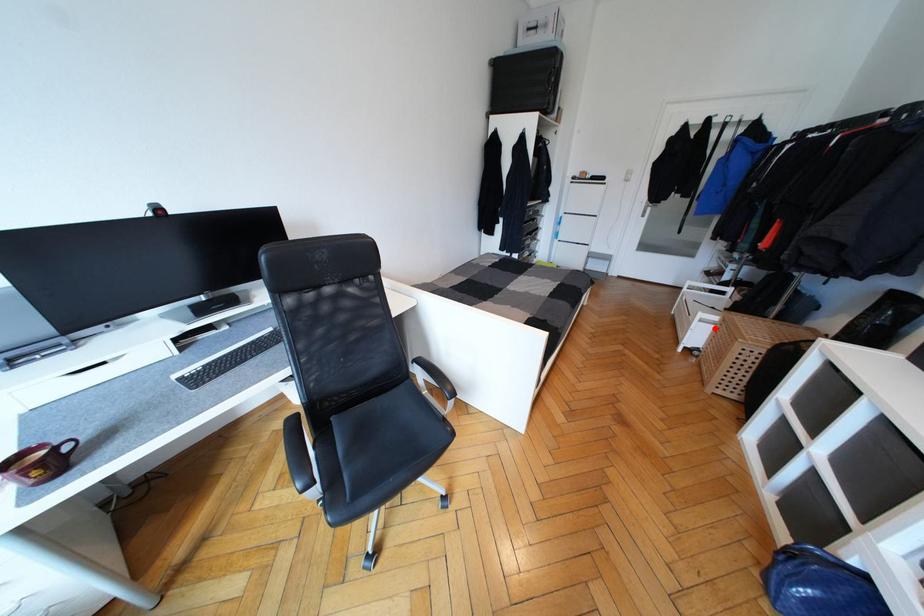
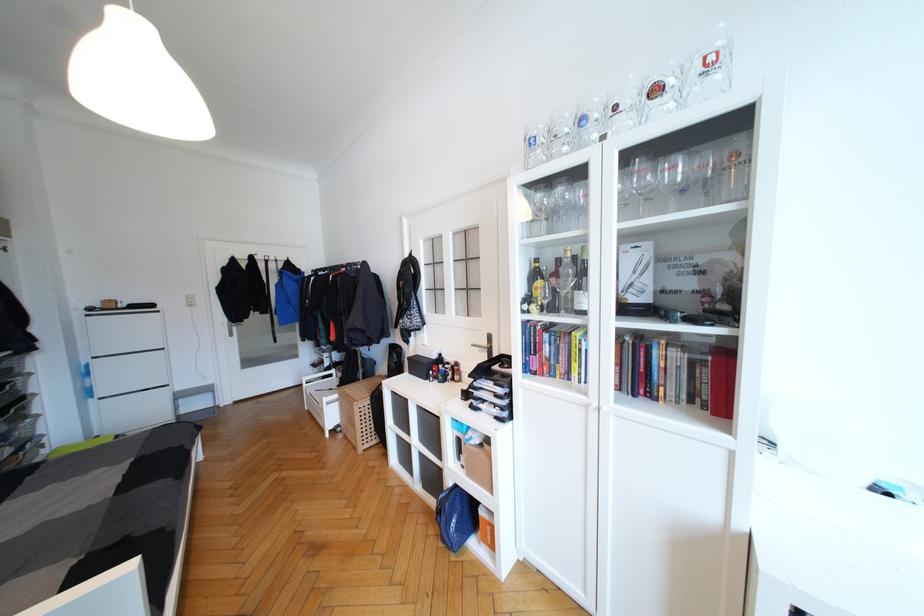
Question: I am providing you with two images of the same scene from different viewpoints. Given a red point in image1, look at the same physical point in image2. Is it:

Choices:
 (A) Closer to the viewpoint
 (B) Farther from the viewpoint

Answer: (B)